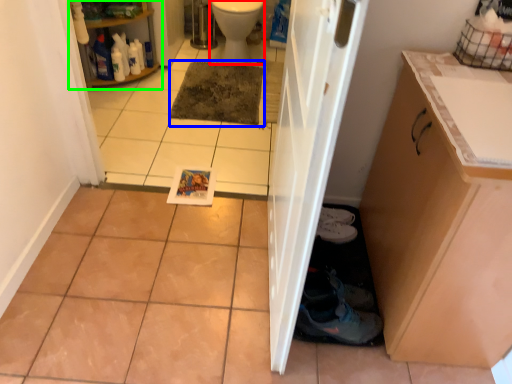
Question: Estimate the real-world distances between objects in this image. Which object is farther from toilet bowl (highlighted by a red box), mat (highlighted by a blue box) or shelf (highlighted by a green box)?

Choices:
 (A) mat
 (B) shelf

Answer: (B)